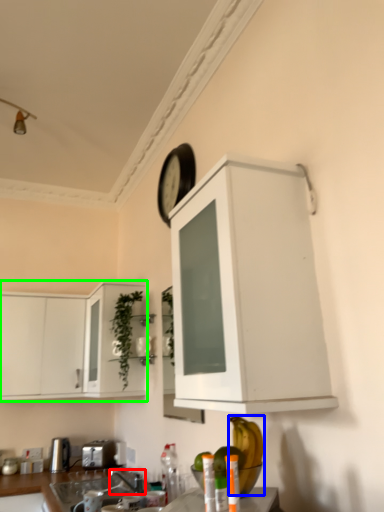
Question: Based on their relative distances, which object is farther from faucet (highlighted by a red box)? Choose from banana (highlighted by a blue box) and cabinetry (highlighted by a green box).

Choices:
 (A) banana
 (B) cabinetry

Answer: (A)